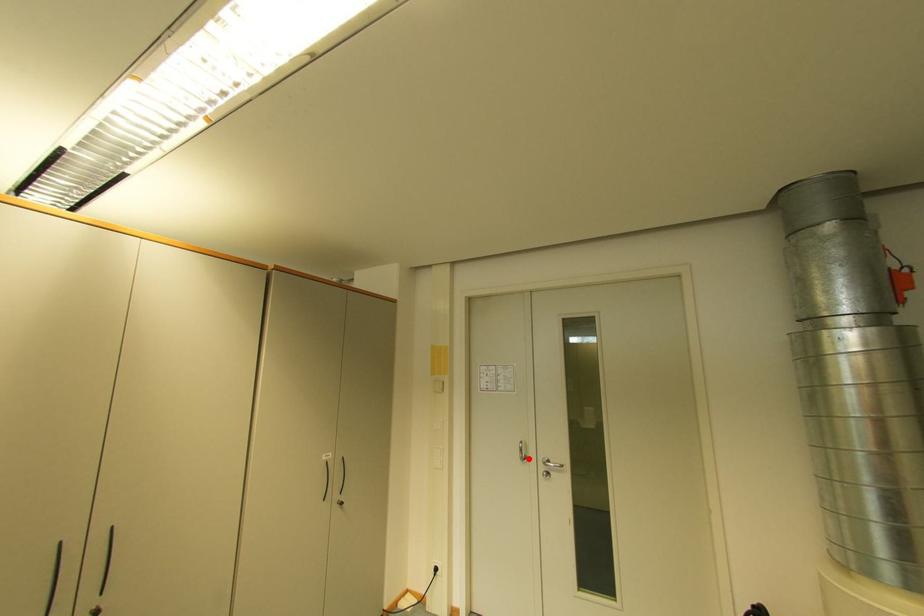
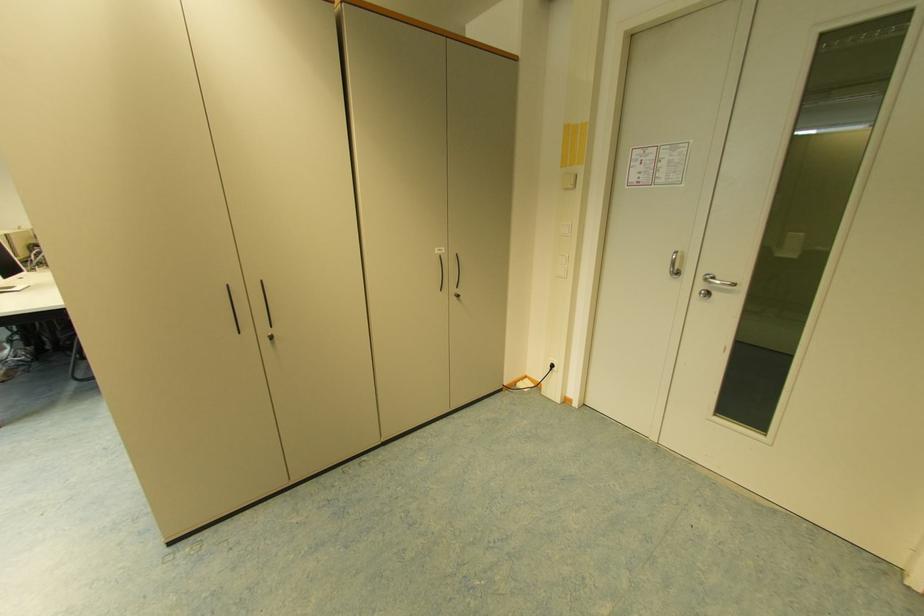
Question: I am providing you with two images of the same scene from different viewpoints. A red point is shown in image1. For the corresponding object point in image2, is it positioned nearer or farther from the camera?

Choices:
 (A) Nearer
 (B) Farther

Answer: (A)